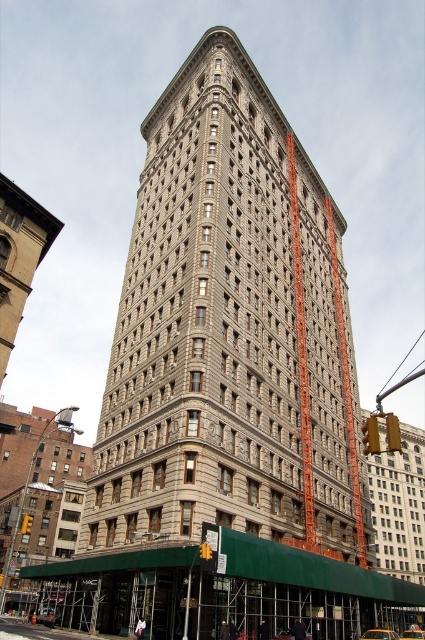
You are a city planner assessing the potential for a new billboard installation. You need to choose between placing it on the brick building at lower left or the matte gray building at lower right. Which building offers a taller structure for better visibility?

The matte gray building at lower right is taller than the brick building at lower left, so placing the billboard on the matte gray building at lower right would provide better visibility due to its greater height.

You are standing in front of the Flatiron Building and want to take a photo that includes both the brick building at lower left and the beige stone building at lower left. Which building should you move closer to in order to include both in your frame?

You should move closer to the beige stone building at lower left because the brick building at lower left is closer to you, so by moving toward the farther beige stone building, both will be within your camera frame.

You are standing in front of the Flatiron Building and want to take a photo that includes both the Flatiron Building and the brick building at lower left. Based on their positions, where should you position yourself to ensure both are in the frame?

To capture both the Flatiron Building and the brick building at lower left in your photo, position yourself so that the brick building at lower left is near the lower left corner of your frame, as its 2D coordinates are at point [39,490], which places it towards the lower left area of the image.